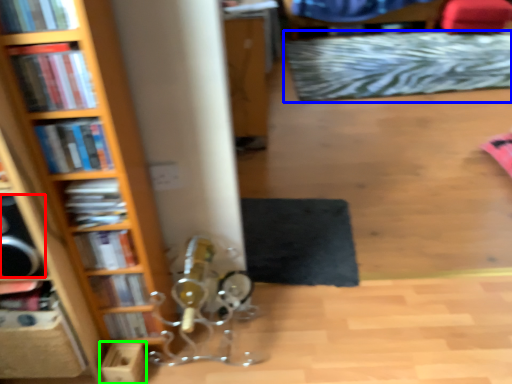
Question: Which object is positioned closest to speaker (highlighted by a red box)? Select from mat (highlighted by a blue box) and cardboard box (highlighted by a green box).

Choices:
 (A) mat
 (B) cardboard box

Answer: (B)